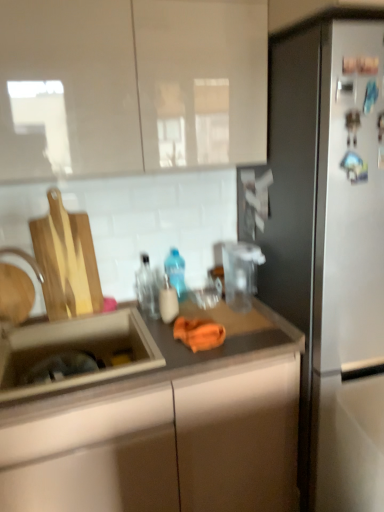
You are a GUI agent. You are given a task and a screenshot of the screen. Output one action in this format:
    pyautogui.click(x=<x>, y=<y>)
    Task: Click on the free point to the left of matte plastic soap dispenser at center, marked as the first bottle in a front-to-back arrangement
    This screenshot has height=512, width=384.
    Given the screenshot: What is the action you would take?
    pyautogui.click(x=139, y=321)